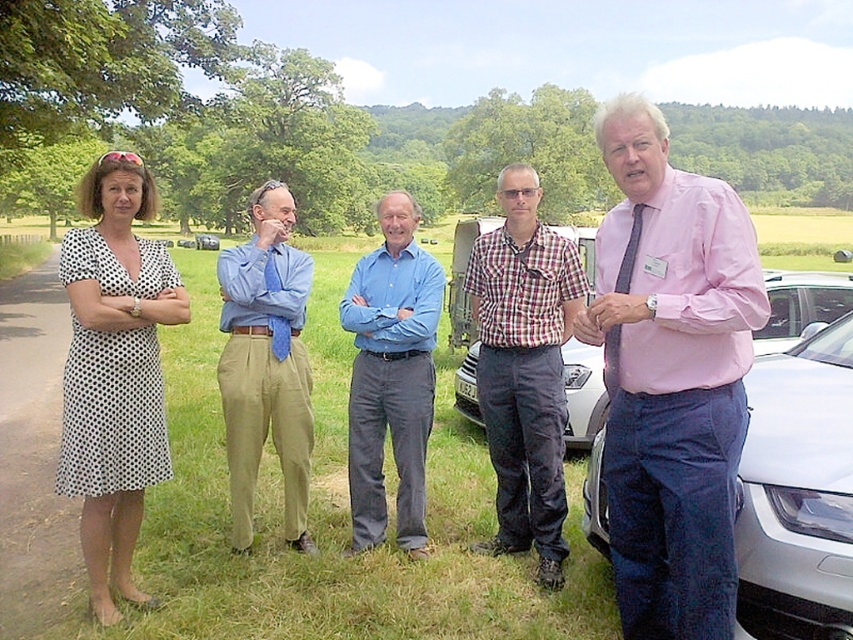
Is point (576, 296) positioned after point (212, 237)?

That is False.

Describe the element at coordinates (524, 368) in the screenshot. This screenshot has width=853, height=640. I see `plaid shirt at center` at that location.

Does point (525, 208) come behind point (196, 236)?

No.

I want to click on plaid shirt at center, so click(x=524, y=368).

Which of these two, white dotted dress at left or white metallic car at right, stands shorter?

white dotted dress at left is shorter.

Is white dotted dress at left wider than white metallic car at right?

In fact, white dotted dress at left might be narrower than white metallic car at right.

Between point (122, 586) and point (786, 284), which one is positioned in front?

Point (122, 586) is in front.

Identify the location of white dotted dress at left. This screenshot has height=640, width=853. (114, 371).

Can you confirm if blue cotton shirt at center is smaller than white metallic car at right?

Correct, blue cotton shirt at center occupies less space than white metallic car at right.

Measure the distance between blue cotton shirt at center and camera.

3.94 meters

Image resolution: width=853 pixels, height=640 pixels. In order to click on blue cotton shirt at center in this screenshot , I will do `click(392, 376)`.